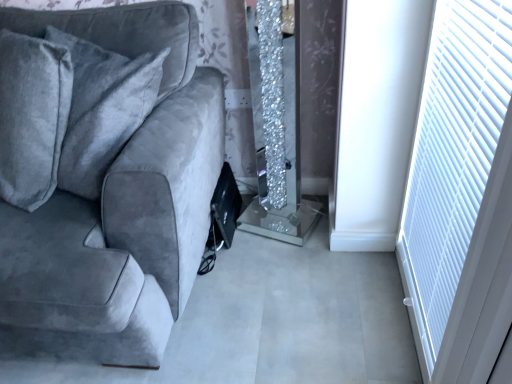
Question: Considering the positions of velvet gray couch at left and white textured blind at right in the image, is velvet gray couch at left wider or thinner than white textured blind at right?

Choices:
 (A) wide
 (B) thin

Answer: (A)

Question: From a real-world perspective, is velvet gray couch at left above or below white textured blind at right?

Choices:
 (A) above
 (B) below

Answer: (B)

Question: Considering their positions, is velvet gray couch at left located in front of or behind white textured blind at right?

Choices:
 (A) behind
 (B) front

Answer: (A)

Question: From a real-world perspective, is white textured blind at right physically located above or below velvet gray couch at left?

Choices:
 (A) above
 (B) below

Answer: (A)

Question: In terms of height, does white textured blind at right look taller or shorter compared to velvet gray couch at left?

Choices:
 (A) tall
 (B) short

Answer: (B)

Question: Looking at their shapes, would you say white textured blind at right is wider or thinner than velvet gray couch at left?

Choices:
 (A) thin
 (B) wide

Answer: (A)

Question: Considering the relative positions of white textured blind at right and velvet gray couch at left in the image provided, is white textured blind at right to the left or to the right of velvet gray couch at left?

Choices:
 (A) left
 (B) right

Answer: (B)